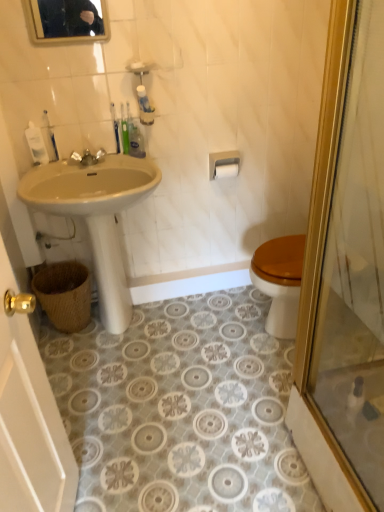
Find the location of a particular element. The height and width of the screenshot is (512, 384). empty space that is in between matte silver faucet at upper center and white plastic bottle at upper left, the third toiletry when ordered from right to left is located at coordinates (59, 166).